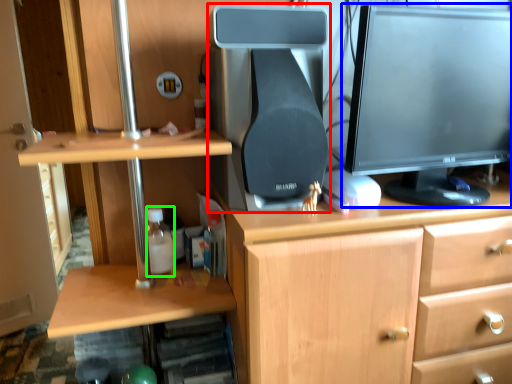
Question: Which object is the closest to the desktop computer (highlighted by a red box)? Choose among these: computer monitor (highlighted by a blue box) or bottle (highlighted by a green box).

Choices:
 (A) computer monitor
 (B) bottle

Answer: (A)